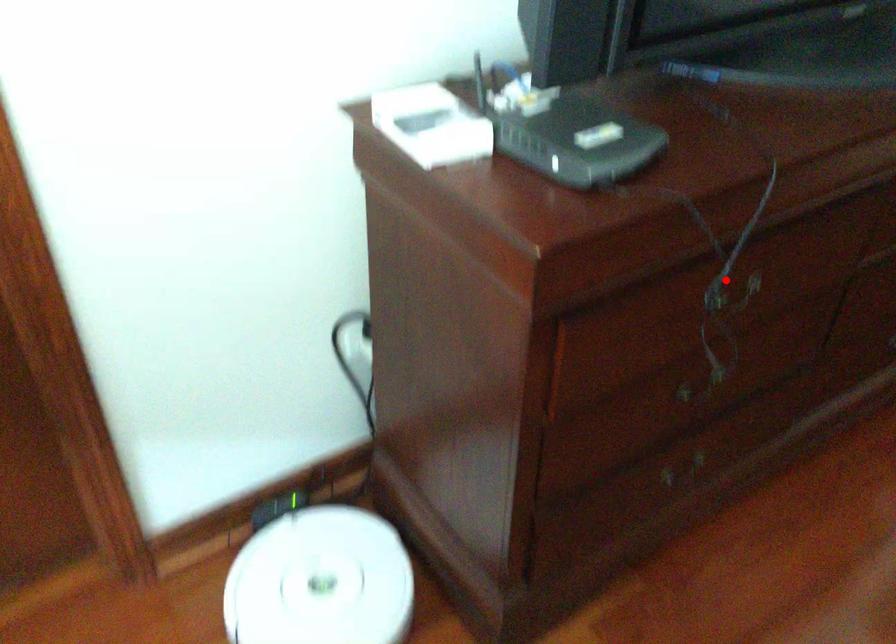
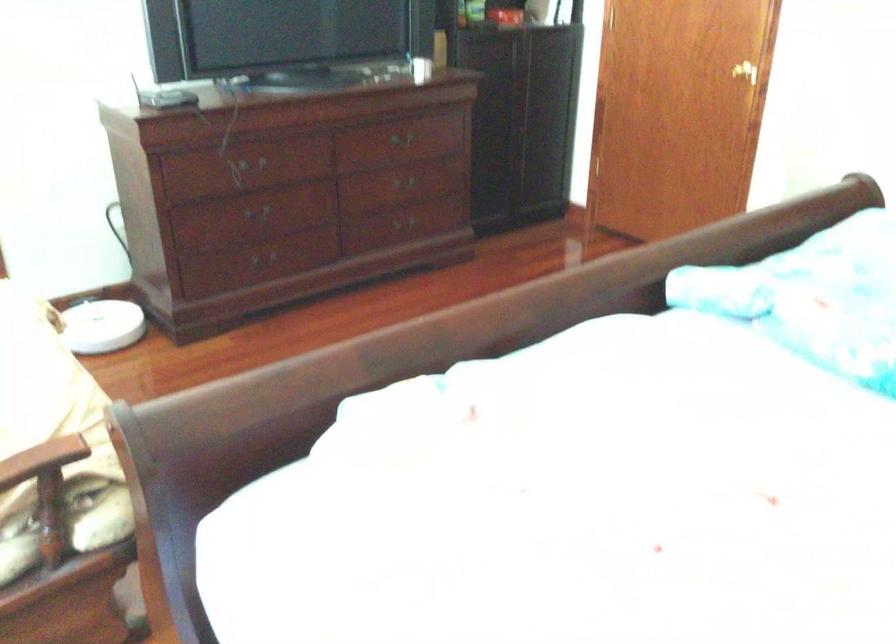
Question: I am providing you with two images of the same scene from different viewpoints. A red point is shown in image1. For the corresponding object point in image2, is it positioned nearer or farther from the camera?

Choices:
 (A) Nearer
 (B) Farther

Answer: (B)